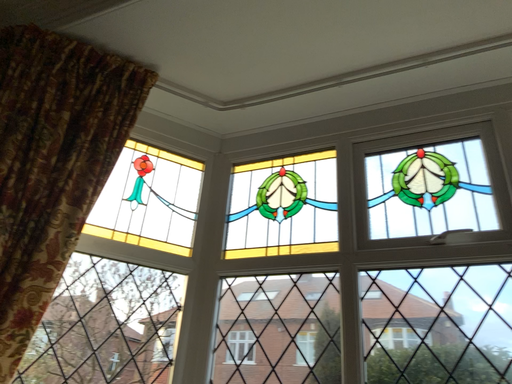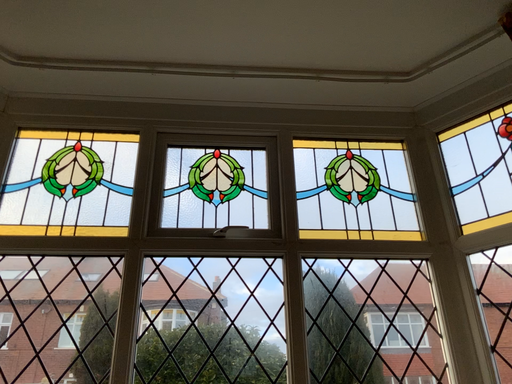
Question: How did the camera likely rotate when shooting the video?

Choices:
 (A) rotated right
 (B) rotated left

Answer: (A)